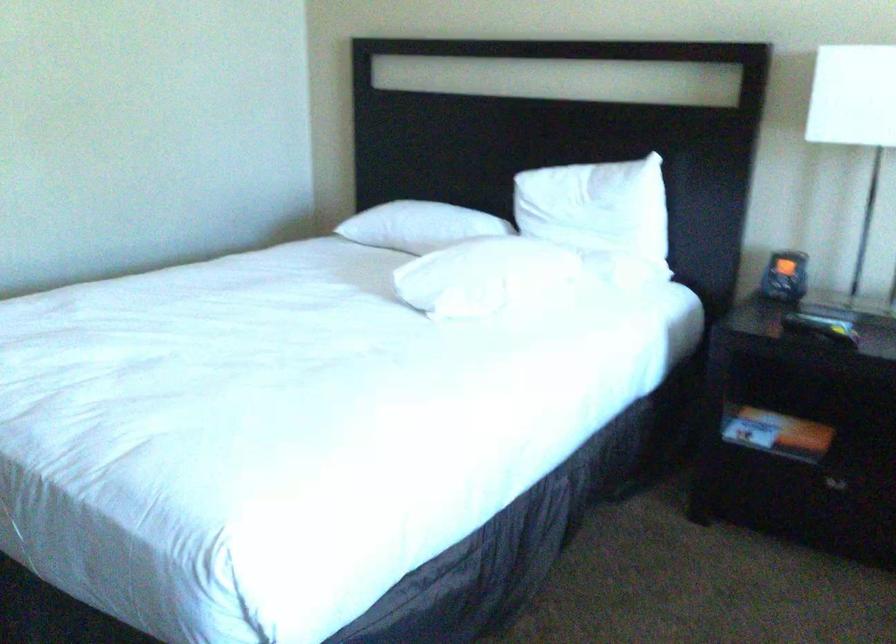
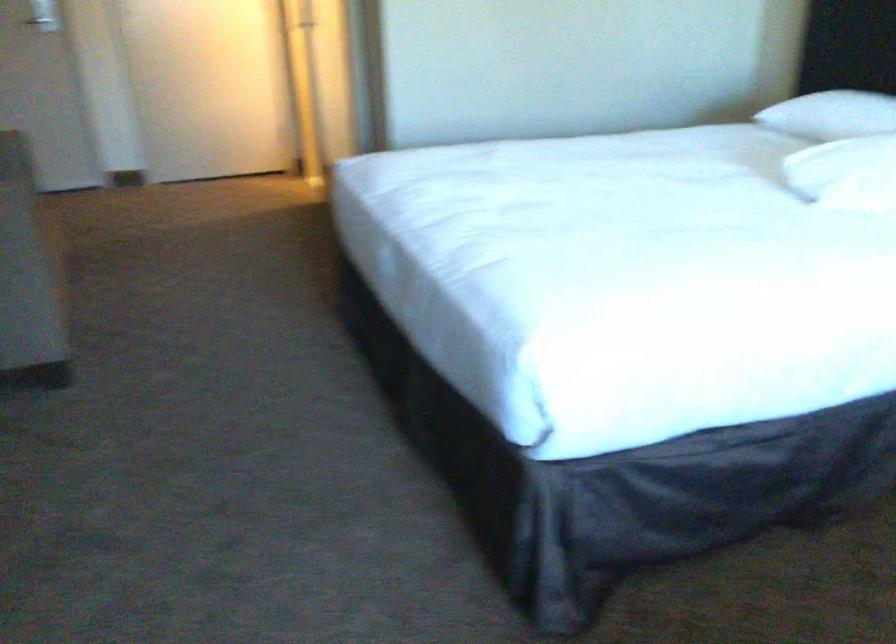
Question: The first image is from the beginning of the video and the second image is from the end. How did the camera likely rotate when shooting the video?

Choices:
 (A) Left
 (B) Right
 (C) Up
 (D) Down

Answer: (A)